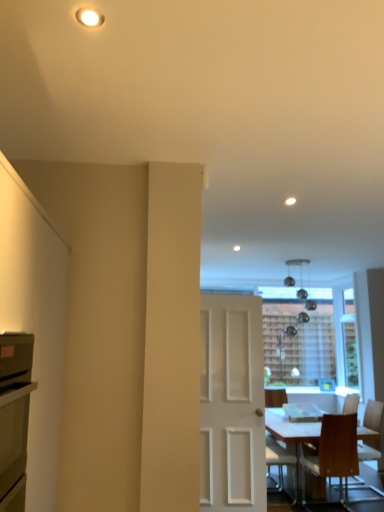
Question: Considering the relative positions of wooden chair at lower right, placed as the 3th chair when sorted from right to left, and wooden chair at lower right, which is counted as the 2th chair, starting from the left, in the image provided, is wooden chair at lower right, placed as the 3th chair when sorted from right to left, to the left of wooden chair at lower right, which is counted as the 2th chair, starting from the left, from the viewer's perspective?

Choices:
 (A) yes
 (B) no

Answer: (A)

Question: Does wooden chair at lower right, placed as the 3th chair when sorted from right to left, have a greater height compared to wooden chair at lower right, positioned as the 2th chair in right-to-left order?

Choices:
 (A) no
 (B) yes

Answer: (A)

Question: From the image's perspective, is wooden chair at lower right, placed as the 3th chair when sorted from right to left, below wooden chair at lower right, which is counted as the 2th chair, starting from the left?

Choices:
 (A) no
 (B) yes

Answer: (B)

Question: From a real-world perspective, is wooden chair at lower right, which is the first chair in left-to-right order, physically below wooden chair at lower right, positioned as the 2th chair in right-to-left order?

Choices:
 (A) yes
 (B) no

Answer: (A)

Question: Is wooden chair at lower right, placed as the 3th chair when sorted from right to left, smaller than wooden chair at lower right, which is counted as the 2th chair, starting from the left?

Choices:
 (A) yes
 (B) no

Answer: (A)

Question: From the image's perspective, is wooden chair at lower right, placed as the 3th chair when sorted from right to left, on top of wooden chair at lower right, positioned as the 2th chair in right-to-left order?

Choices:
 (A) no
 (B) yes

Answer: (A)

Question: From the image's perspective, is wooden chair at lower right, which is the first chair in left-to-right order, under white matte door at center?

Choices:
 (A) no
 (B) yes

Answer: (B)

Question: Considering the relative sizes of wooden chair at lower right, placed as the 3th chair when sorted from right to left, and white matte door at center in the image provided, is wooden chair at lower right, placed as the 3th chair when sorted from right to left, thinner than white matte door at center?

Choices:
 (A) yes
 (B) no

Answer: (B)

Question: Is wooden chair at lower right, which is the first chair in left-to-right order, smaller than white matte door at center?

Choices:
 (A) no
 (B) yes

Answer: (B)

Question: Is wooden chair at lower right, placed as the 3th chair when sorted from right to left, bigger than white matte door at center?

Choices:
 (A) yes
 (B) no

Answer: (B)

Question: Is wooden chair at lower right, placed as the 3th chair when sorted from right to left, in contact with white matte door at center?

Choices:
 (A) no
 (B) yes

Answer: (A)

Question: Is wooden chair at lower right, which is the first chair in left-to-right order, in front of white matte door at center?

Choices:
 (A) no
 (B) yes

Answer: (A)

Question: Is wooden chair at lower right, which is counted as the 2th chair, starting from the left, positioned with its back to white matte door at center?

Choices:
 (A) no
 (B) yes

Answer: (A)